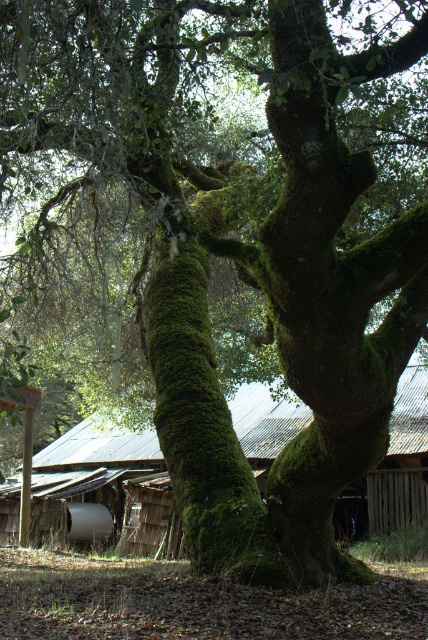
Is rusty corrugated metal hut at center above green mossy tree trunk at center?

No.

Is rusty corrugated metal hut at center wider than green mossy tree trunk at center?

Correct, the width of rusty corrugated metal hut at center exceeds that of green mossy tree trunk at center.

Is point (64, 484) less distant than point (155, 259)?

No, (64, 484) is behind (155, 259).

You are a GUI agent. You are given a task and a screenshot of the screen. Output one action in this format:
    pyautogui.click(x=<x>, y=<y>)
    Task: Click on the rusty corrugated metal hut at center
    This screenshot has width=428, height=640.
    Given the screenshot: What is the action you would take?
    pyautogui.click(x=107, y=484)